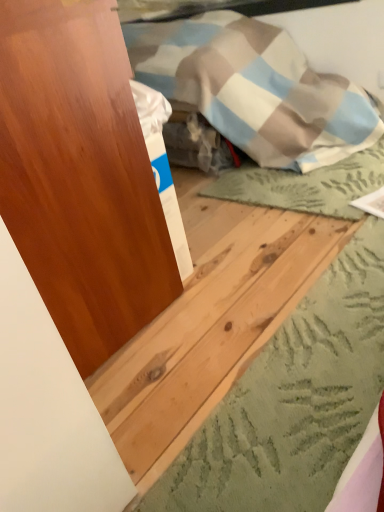
Locate an element on the screen. This screenshot has width=384, height=512. free point to the right of matte wood dresser at left is located at coordinates (257, 261).